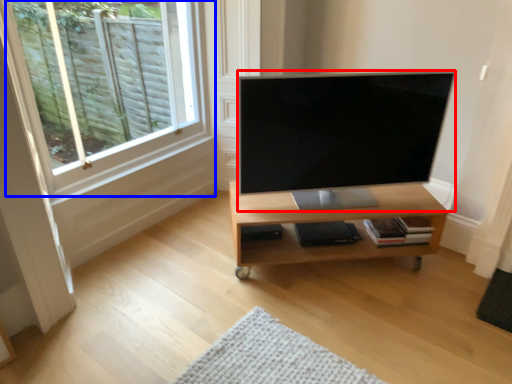
Question: Which of the following is the closest to the observer, television (highlighted by a red box) or window (highlighted by a blue box)?

Choices:
 (A) television
 (B) window

Answer: (B)